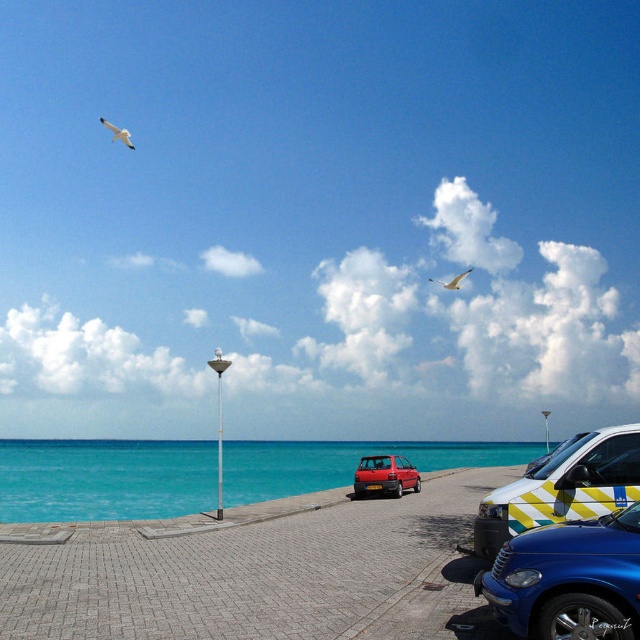
The height and width of the screenshot is (640, 640). What do you see at coordinates (568, 579) in the screenshot? I see `blue glossy car at lower right` at bounding box center [568, 579].

Is blue glossy car at lower right positioned in front of white feathered bird at upper left?

Yes, blue glossy car at lower right is in front of white feathered bird at upper left.

The image size is (640, 640). What do you see at coordinates (568, 579) in the screenshot? I see `blue glossy car at lower right` at bounding box center [568, 579].

Find the location of a particular element. Image resolution: width=640 pixels, height=640 pixels. blue glossy car at lower right is located at coordinates (568, 579).

Which is above, turquoise glossy water at lower left or matte red car at center?

matte red car at center is higher up.

Is turquoise glossy water at lower left to the right of matte red car at center from the viewer's perspective?

Incorrect, turquoise glossy water at lower left is not on the right side of matte red car at center.

Consider the image. Who is more forward, (x=84, y=502) or (x=374, y=460)?

Point (x=374, y=460) is more forward.

Identify the location of turquoise glossy water at lower left. The width and height of the screenshot is (640, 640). (104, 480).

Which is below, blue glossy car at lower right or yellow and white striped ambulance at lower right?

yellow and white striped ambulance at lower right

Image resolution: width=640 pixels, height=640 pixels. Find the location of `blue glossy car at lower right`. blue glossy car at lower right is located at coordinates (568, 579).

Which is behind, point (550, 554) or point (540, 500)?

The point (540, 500) is more distant.

What are the coordinates of `blue glossy car at lower right` in the screenshot? It's located at (568, 579).